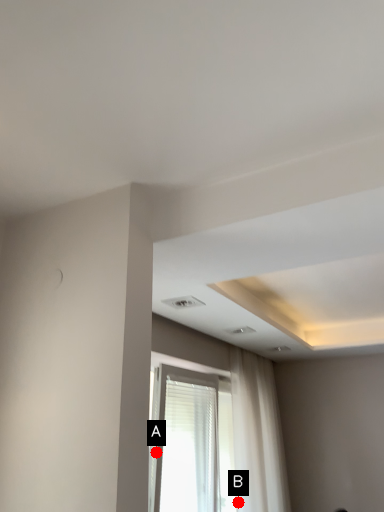
Question: Two points are circled on the image, labeled by A and B beside each circle. Which point is farther to the camera?

Choices:
 (A) A is further
 (B) B is further

Answer: (B)